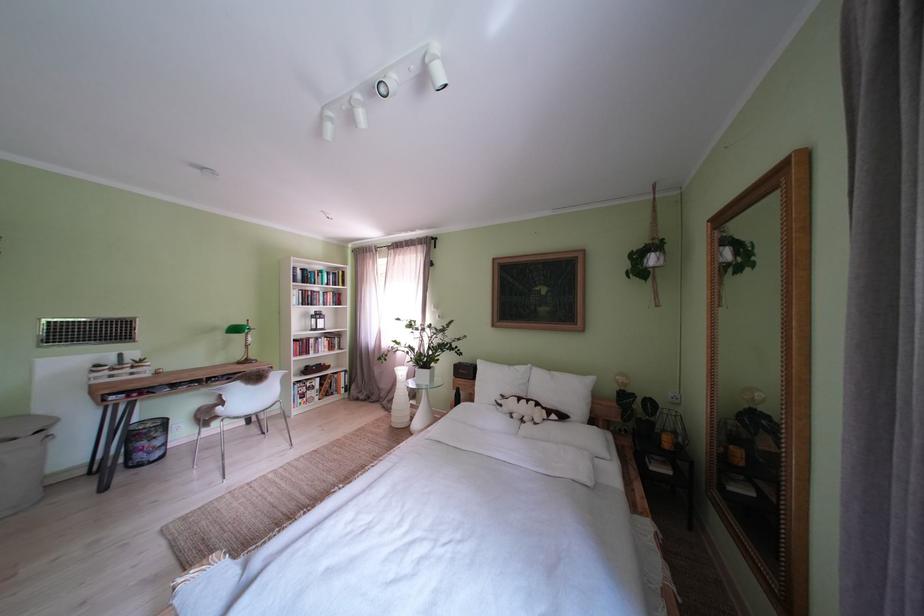
The width and height of the screenshot is (924, 616). What are the coordinates of `white vase` in the screenshot? It's located at (399, 400).